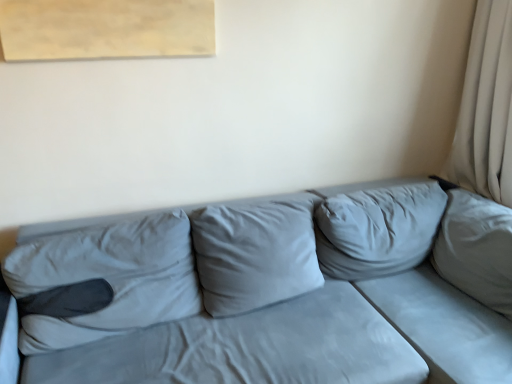
Locate an element on the screen. Image resolution: width=512 pixels, height=384 pixels. suede gray couch at center is located at coordinates (255, 296).

Describe the element at coordinates (255, 296) in the screenshot. I see `suede gray couch at center` at that location.

Where is `beige fabric curtain at right`? This screenshot has width=512, height=384. beige fabric curtain at right is located at coordinates 486,108.

The width and height of the screenshot is (512, 384). What do you see at coordinates (486, 108) in the screenshot?
I see `beige fabric curtain at right` at bounding box center [486, 108].

Locate an element on the screen. suede gray couch at center is located at coordinates (255, 296).

Is beige fabric curtain at right to the right of suede gray couch at center from the viewer's perspective?

Yes, beige fabric curtain at right is to the right of suede gray couch at center.

Who is more distant, beige fabric curtain at right or suede gray couch at center?

beige fabric curtain at right.

Does point (447, 162) appear closer or farther from the camera than point (249, 227)?

Point (447, 162).

From the image's perspective, is beige fabric curtain at right on top of suede gray couch at center?

Correct, beige fabric curtain at right appears higher than suede gray couch at center in the image.

From a real-world perspective, is beige fabric curtain at right under suede gray couch at center?

Actually, beige fabric curtain at right is physically above suede gray couch at center in the real world.

Does beige fabric curtain at right have a lesser width compared to suede gray couch at center?

Correct, the width of beige fabric curtain at right is less than that of suede gray couch at center.

Is beige fabric curtain at right taller or shorter than suede gray couch at center?

beige fabric curtain at right is taller than suede gray couch at center.

Is beige fabric curtain at right smaller than suede gray couch at center?

Correct, beige fabric curtain at right occupies less space than suede gray couch at center.

Is beige fabric curtain at right spatially inside suede gray couch at center, or outside of it?

beige fabric curtain at right is not inside suede gray couch at center, it's outside.

Are beige fabric curtain at right and suede gray couch at center making contact?

beige fabric curtain at right and suede gray couch at center are not in contact.

Is beige fabric curtain at right turned away from suede gray couch at center?

No, beige fabric curtain at right is not facing away from suede gray couch at center.

What's the angular difference between beige fabric curtain at right and suede gray couch at center's facing directions?

They differ by 93.3 degrees in their facing directions.

This screenshot has height=384, width=512. I want to click on curtain behind the suede gray couch at center, so click(x=486, y=108).

Which object is positioned more to the right, suede gray couch at center or beige fabric curtain at right?

From the viewer's perspective, beige fabric curtain at right appears more on the right side.

Which object is further away from the camera taking this photo, suede gray couch at center or beige fabric curtain at right?

beige fabric curtain at right is further away from the camera.

Is point (302, 312) positioned behind point (490, 83)?

No.

From the image's perspective, which object appears higher, suede gray couch at center or beige fabric curtain at right?

beige fabric curtain at right appears higher in the image.

From a real-world perspective, which is physically above, suede gray couch at center or beige fabric curtain at right?

From a 3D spatial view, beige fabric curtain at right is above.

Does suede gray couch at center have a greater width compared to beige fabric curtain at right?

Indeed, suede gray couch at center has a greater width compared to beige fabric curtain at right.

Is suede gray couch at center taller or shorter than beige fabric curtain at right?

Clearly, suede gray couch at center is shorter compared to beige fabric curtain at right.

Is suede gray couch at center bigger than beige fabric curtain at right?

Yes.

Is suede gray couch at center located outside beige fabric curtain at right?

Yes, suede gray couch at center is located beyond the bounds of beige fabric curtain at right.

Are suede gray couch at center and beige fabric curtain at right far apart?

They are positioned close to each other.

Is suede gray couch at center oriented away from beige fabric curtain at right?

No.

How different are the orientations of suede gray couch at center and beige fabric curtain at right in degrees?

suede gray couch at center and beige fabric curtain at right are facing 93.3 degrees away from each other.

The image size is (512, 384). Find the location of `studio couch on the left of beige fabric curtain at right`. studio couch on the left of beige fabric curtain at right is located at coordinates (255, 296).

Locate an element on the screen. curtain above the suede gray couch at center (from the image's perspective) is located at coordinates (486, 108).

You are a GUI agent. You are given a task and a screenshot of the screen. Output one action in this format:
    pyautogui.click(x=<x>, y=<y>)
    Task: Click on the curtain above the suede gray couch at center (from a real-world perspective)
    The height and width of the screenshot is (384, 512).
    Given the screenshot: What is the action you would take?
    pyautogui.click(x=486, y=108)